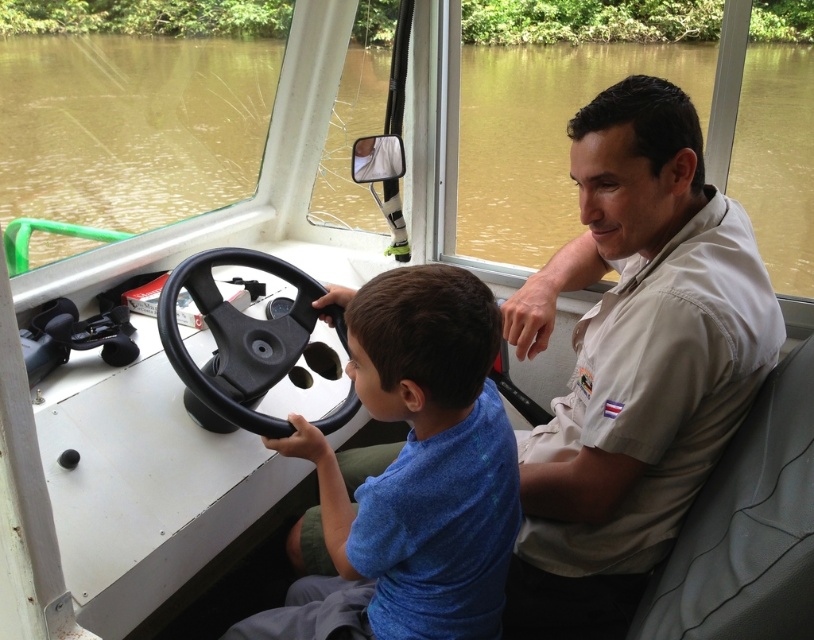
Based on the photo, you are standing on the dock and looking at the boat. There is a point marked at coordinates (633, 362). What object is located at that point?

The point at coordinates (633, 362) marks the white cotton shirt at right.

You are a passenger on the boat and need to locate the white cotton shirt at right. According to the coordinates given, where exactly is it positioned on the boat?

The white cotton shirt at right is located at point coordinates of 0.567 on the x axis and 0.779 on the y axis.